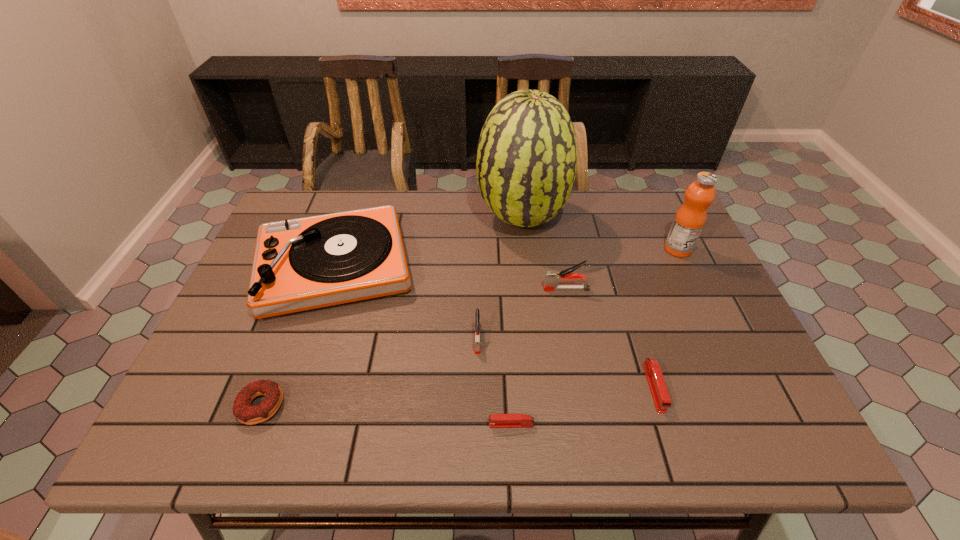
Identify the location of doughnut present at the left edge. (245, 413).

Identify the location of object that is at the right edge. This screenshot has height=540, width=960. (690, 218).

Locate an element on the screen. The width and height of the screenshot is (960, 540). object at the far left corner is located at coordinates (300, 264).

The image size is (960, 540). What are the coordinates of `object situated at the near left corner` in the screenshot? It's located at (245, 413).

The width and height of the screenshot is (960, 540). In the image, there is a desktop. Find the location of `vacant region at the far edge`. vacant region at the far edge is located at coordinates (355, 201).

In order to click on free space at the near edge of the desktop in this screenshot , I will do `click(608, 443)`.

You are a GUI agent. You are given a task and a screenshot of the screen. Output one action in this format:
    pyautogui.click(x=<x>, y=<y>)
    Task: Click on the vacant position at the left edge of the desktop
    
    Given the screenshot: What is the action you would take?
    pyautogui.click(x=278, y=330)

Identify the location of free space at the right edge of the desktop. This screenshot has width=960, height=540. (669, 273).

Identify the location of vacant space at the far left corner. (293, 219).

What are the coordinates of `vacant area at the far right corner` in the screenshot? It's located at (646, 194).